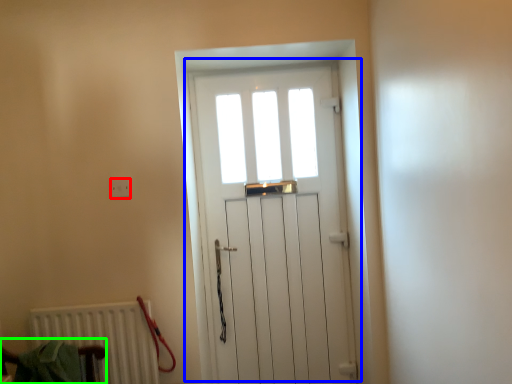
Question: Based on their relative distances, which object is nearer to electric outlet (highlighted by a red box)? Choose from door (highlighted by a blue box) and armchair (highlighted by a green box).

Choices:
 (A) door
 (B) armchair

Answer: (B)